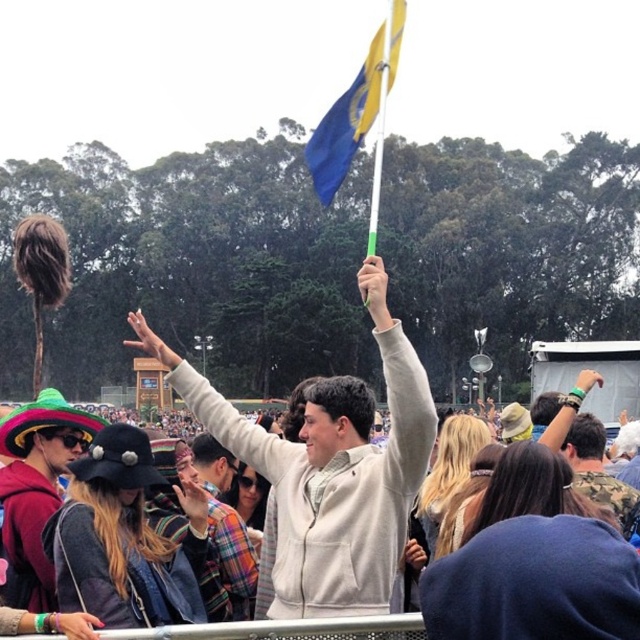
Does light gray fleece jacket at center have a lesser width compared to blue fabric flag at upper center?

In fact, light gray fleece jacket at center might be wider than blue fabric flag at upper center.

At what (x,y) coordinates should I click in order to perform the action: click on light gray fleece jacket at center. Please return your answer as a coordinate pair (x, y). The image size is (640, 640). Looking at the image, I should click on (330, 468).

Who is more distant from viewer, (192, 369) or (387, 72)?

The point (192, 369) is behind.

Where is `light gray fleece jacket at center`? light gray fleece jacket at center is located at coordinates (330, 468).

What do you see at coordinates (355, 108) in the screenshot? I see `blue fabric flag at upper center` at bounding box center [355, 108].

Between point (314, 131) and point (573, 484), which one is positioned behind?

Point (314, 131)

Where is `blue fabric flag at upper center`? The image size is (640, 640). blue fabric flag at upper center is located at coordinates (355, 108).

Identify the location of blue fabric flag at upper center. click(x=355, y=108).

Is point (356, 449) positioned behind point (552, 444)?

That is False.

Which is above, light gray fleece jacket at center or camouflage fabric shirt at upper right?

Positioned higher is light gray fleece jacket at center.

Who is more distant from viewer, (336, 396) or (627, 516)?

Positioned behind is point (627, 516).

Identify the location of light gray fleece jacket at center. The width and height of the screenshot is (640, 640). (330, 468).